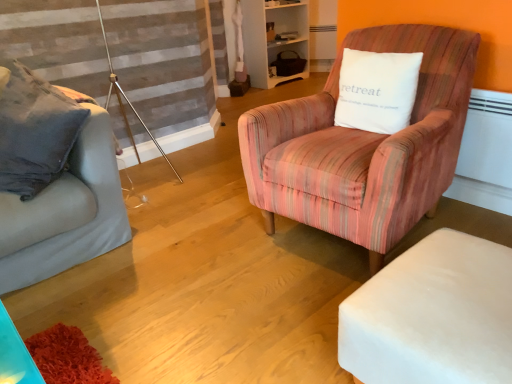
Question: From a real-world perspective, is white fabric ottoman at lower right located beneath white wood bookshelf at upper center?

Choices:
 (A) yes
 (B) no

Answer: (A)

Question: Does white fabric ottoman at lower right have a lesser width compared to white wood bookshelf at upper center?

Choices:
 (A) yes
 (B) no

Answer: (A)

Question: Would you say white fabric ottoman at lower right is outside white wood bookshelf at upper center?

Choices:
 (A) no
 (B) yes

Answer: (B)

Question: Is white wood bookshelf at upper center inside white fabric ottoman at lower right?

Choices:
 (A) yes
 (B) no

Answer: (B)

Question: Could you tell me if white fabric ottoman at lower right is facing white wood bookshelf at upper center?

Choices:
 (A) yes
 (B) no

Answer: (B)

Question: Would you consider white fabric ottoman at lower right to be distant from white wood bookshelf at upper center?

Choices:
 (A) no
 (B) yes

Answer: (B)

Question: From a real-world perspective, is white soft cushion at upper right over matte gray couch at left?

Choices:
 (A) no
 (B) yes

Answer: (B)

Question: Does white soft cushion at upper right turn towards matte gray couch at left?

Choices:
 (A) no
 (B) yes

Answer: (A)

Question: From a real-world perspective, is white soft cushion at upper right under matte gray couch at left?

Choices:
 (A) no
 (B) yes

Answer: (A)

Question: Considering the relative sizes of white soft cushion at upper right and matte gray couch at left in the image provided, is white soft cushion at upper right shorter than matte gray couch at left?

Choices:
 (A) yes
 (B) no

Answer: (A)

Question: Considering the relative sizes of white soft cushion at upper right and matte gray couch at left in the image provided, is white soft cushion at upper right bigger than matte gray couch at left?

Choices:
 (A) yes
 (B) no

Answer: (B)

Question: Is white soft cushion at upper right touching matte gray couch at left?

Choices:
 (A) no
 (B) yes

Answer: (A)

Question: Would you consider white wood bookshelf at upper center to be distant from white fabric ottoman at lower right?

Choices:
 (A) no
 (B) yes

Answer: (B)